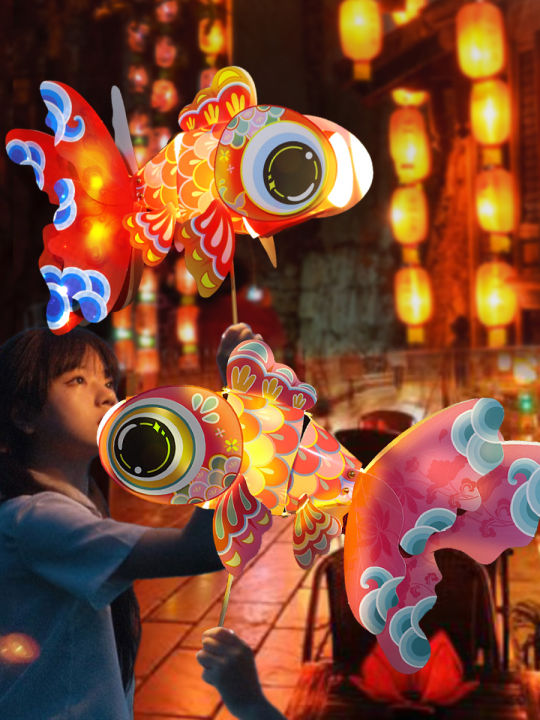
Find the location of a particular element. table is located at coordinates (306, 696).